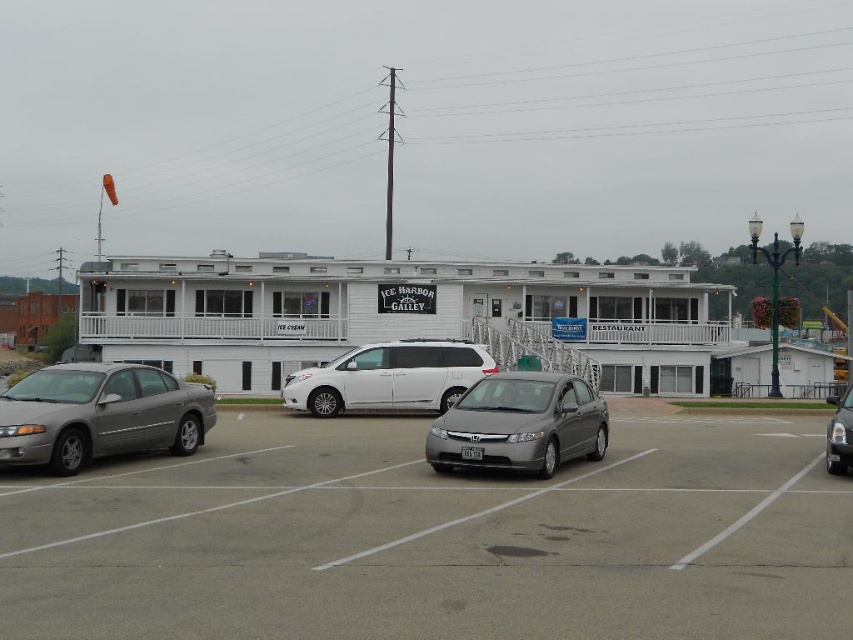
Question: Is white painted building at center to the right of shiny black sedan at right from the viewer's perspective?

Choices:
 (A) no
 (B) yes

Answer: (A)

Question: Can you confirm if gray metallic car at center is positioned above satin silver sedan at center?

Choices:
 (A) yes
 (B) no

Answer: (B)

Question: Based on their relative distances, which object is nearer to the white matte van at center?

Choices:
 (A) white painted building at center
 (B) gray metallic car at center
 (C) silver metallic sedan at left

Answer: (C)

Question: Which object is the closest to the satin silver sedan at center?

Choices:
 (A) white painted building at center
 (B) gray metallic car at center
 (C) shiny black sedan at right
 (D) white matte van at center

Answer: (B)

Question: Which of the following is the closest to the observer?

Choices:
 (A) (538, 467)
 (B) (556, 593)
 (C) (346, 401)
 (D) (653, 278)

Answer: (B)

Question: Does white painted building at center have a larger size compared to white matte van at center?

Choices:
 (A) no
 (B) yes

Answer: (B)